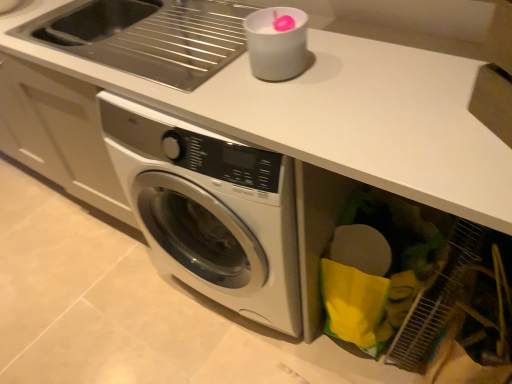
I want to click on vacant area that is in front of white plastic cup at upper center, so click(x=274, y=101).